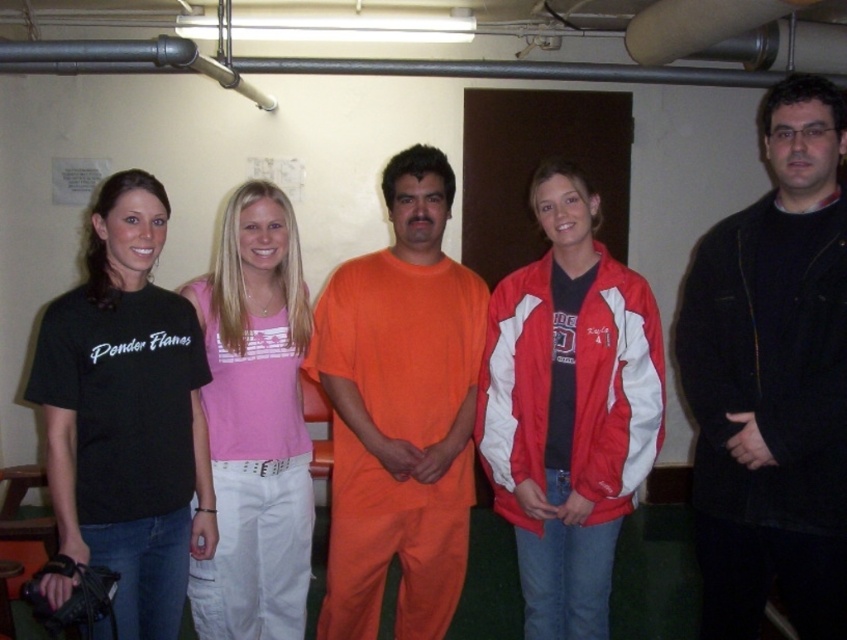
Can you confirm if black matte jacket at center is shorter than red and white jacket at center?

In fact, black matte jacket at center may be taller than red and white jacket at center.

The width and height of the screenshot is (847, 640). What do you see at coordinates (773, 380) in the screenshot? I see `black matte jacket at center` at bounding box center [773, 380].

Based on the photo, measure the distance between point [768,225] and camera.

Point [768,225] and camera are 2.05 meters apart.

The width and height of the screenshot is (847, 640). Find the location of `black matte jacket at center`. black matte jacket at center is located at coordinates (773, 380).

Is black cotton t-shirt at left bigger than pink fabric tank top at center?

Yes.

Which is below, black cotton t-shirt at left or pink fabric tank top at center?

pink fabric tank top at center is below.

Where is `black cotton t-shirt at left`? The width and height of the screenshot is (847, 640). black cotton t-shirt at left is located at coordinates (126, 413).

Does black matte jacket at center appear over pink fabric tank top at center?

Yes, black matte jacket at center is above pink fabric tank top at center.

Who is more forward, (784, 285) or (263, 577)?

Point (784, 285) is more forward.

Is point (768, 141) in front of point (302, 310)?

Yes, it is in front of point (302, 310).

The height and width of the screenshot is (640, 847). Find the location of `black matte jacket at center`. black matte jacket at center is located at coordinates (773, 380).